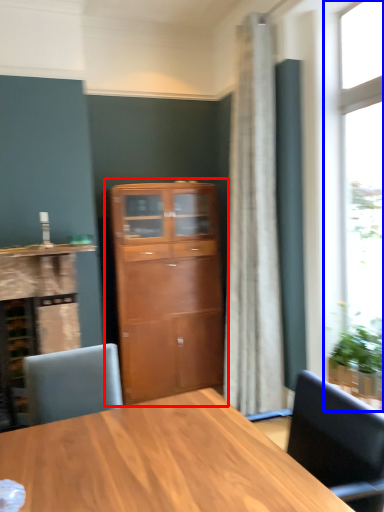
Question: Which point is further to the camera, cupboard (highlighted by a red box) or window (highlighted by a blue box)?

Choices:
 (A) cupboard
 (B) window

Answer: (A)